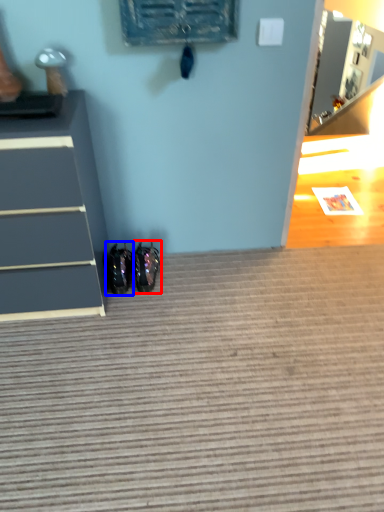
Question: Which point is closer to the camera, footwear (highlighted by a red box) or footwear (highlighted by a blue box)?

Choices:
 (A) footwear
 (B) footwear

Answer: (B)